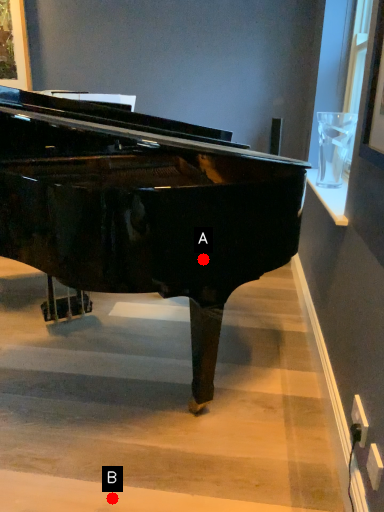
Question: Two points are circled on the image, labeled by A and B beside each circle. Which point is farther from the camera taking this photo?

Choices:
 (A) A is further
 (B) B is further

Answer: (A)